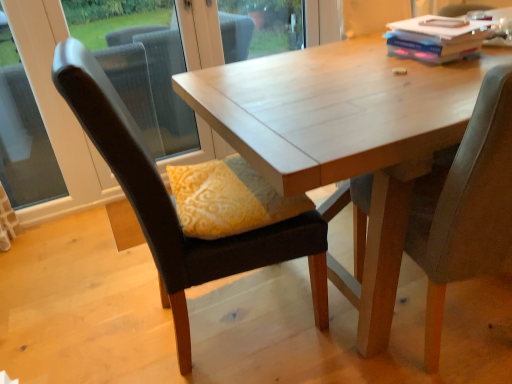
Question: Would you say hardcover book at upper right is to the left or to the right of wooden table at center in the picture?

Choices:
 (A) right
 (B) left

Answer: (B)

Question: From the image's perspective, is hardcover book at upper right above or below wooden table at center?

Choices:
 (A) below
 (B) above

Answer: (B)

Question: Considering the real-world distances, which object is closest to the transparent glass window at left?

Choices:
 (A) wooden table at center
 (B) white plastic window frame at upper left
 (C) hardcover book at upper right
 (D) velvet grey chair at right, the first chair from the right
 (E) velvet dark brown chair at center, placed as the 1th chair when sorted from left to right

Answer: (B)

Question: Which is farther from the white plastic window frame at upper left?

Choices:
 (A) hardcover book at upper right
 (B) velvet dark brown chair at center, which appears as the second chair when viewed from the right
 (C) wooden table at center
 (D) yellow fabric pillow at center
 (E) velvet grey chair at right, which ranks as the second chair in left-to-right order

Answer: (E)